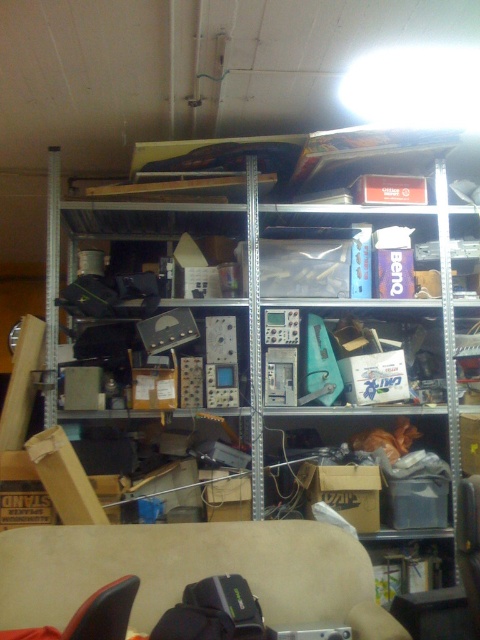
Question: Can you confirm if metallic gray electronics at center is positioned above beige fabric couch at lower center?

Choices:
 (A) yes
 (B) no

Answer: (A)

Question: Can you confirm if metallic gray electronics at center is bigger than beige fabric couch at lower center?

Choices:
 (A) no
 (B) yes

Answer: (B)

Question: Which object is farther from the camera taking this photo?

Choices:
 (A) metallic gray electronics at center
 (B) beige fabric couch at lower center

Answer: (A)

Question: Can you confirm if metallic gray electronics at center is positioned above beige fabric couch at lower center?

Choices:
 (A) no
 (B) yes

Answer: (B)

Question: Which of the following is the closest to the observer?

Choices:
 (A) beige fabric couch at lower center
 (B) metallic gray electronics at center

Answer: (A)